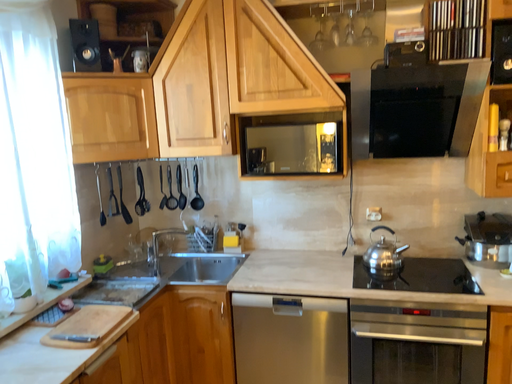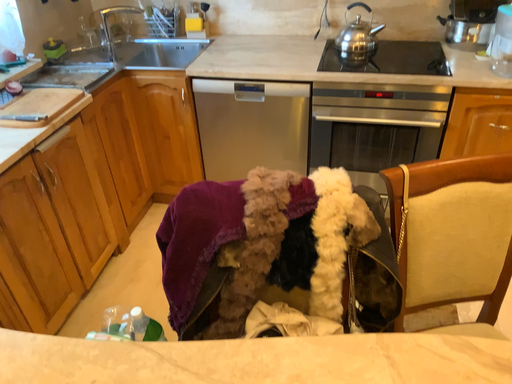
Question: How did the camera likely rotate when shooting the video?

Choices:
 (A) rotated downward
 (B) rotated upward

Answer: (A)